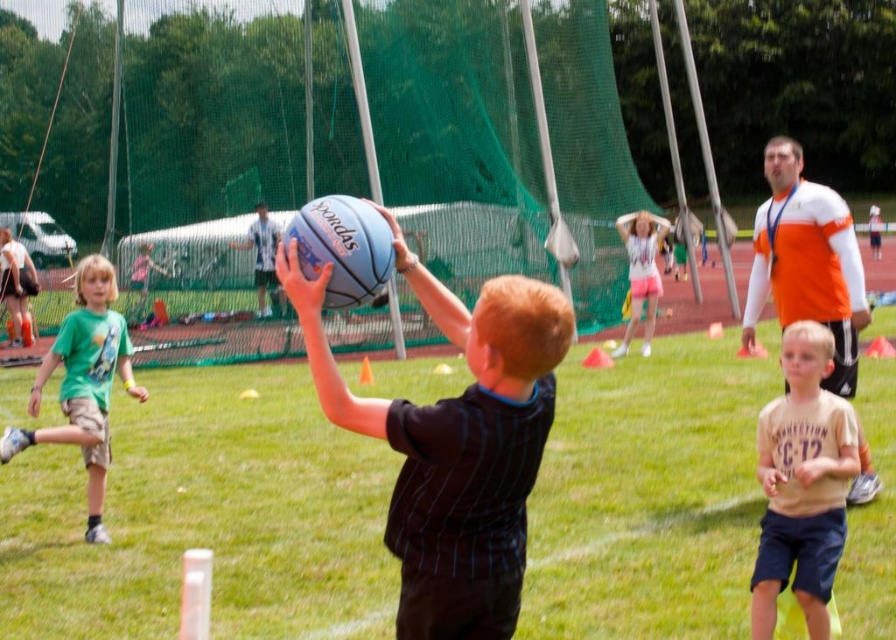
You are a referee at a youth sports event. You need to ensure that the blue rubber ball at center is within a 4 meter safety zone around the orange jersey at center. Is the ball within the safety zone?

The distance between the blue rubber ball at center and the orange jersey at center is 3.89 meters, which is within the 4 meter safety zone. Therefore, the ball is within the safety zone.